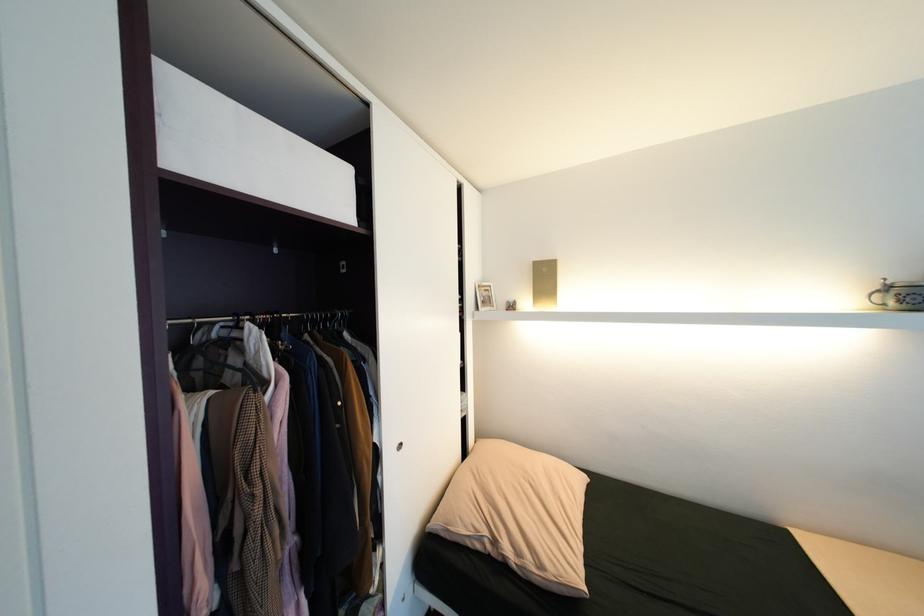
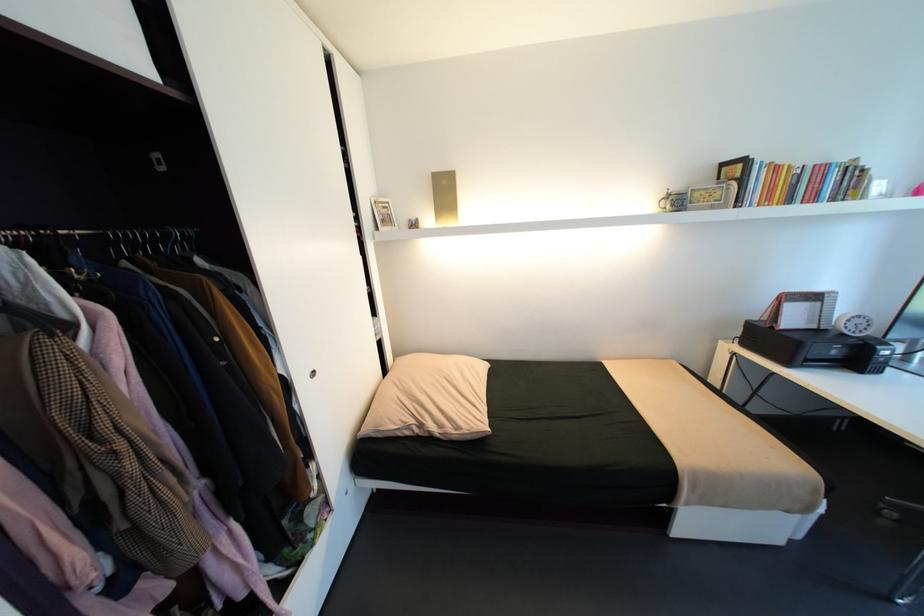
Question: I am providing you with two images of the same scene from different viewpoints. After the viewpoint changes to image2, which objects are now occluded?

Choices:
 (A) silver picture frame
 (B) tan pillow
 (C) white analog clock
 (D) none of these

Answer: (D)